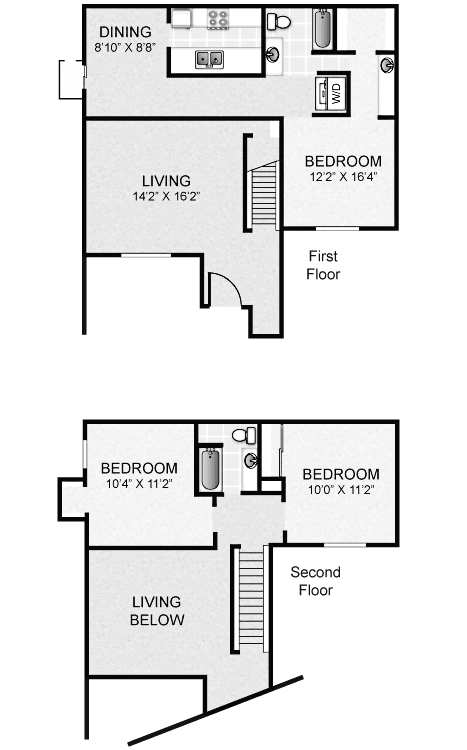
This screenshot has height=750, width=467. What are the coordinates of `room label` in the screenshot? It's located at (123, 30), (158, 182), (342, 160), (339, 472), (138, 468), (152, 603).